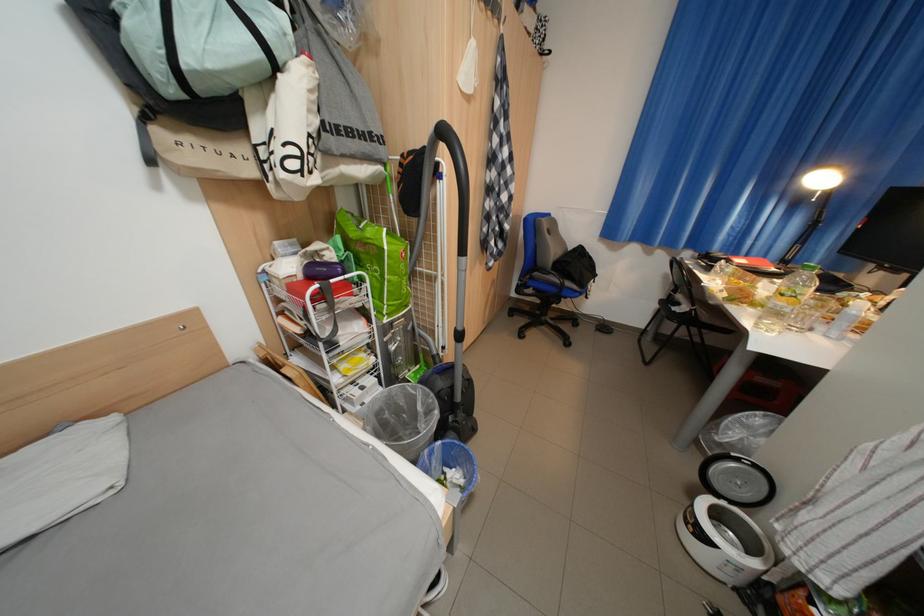
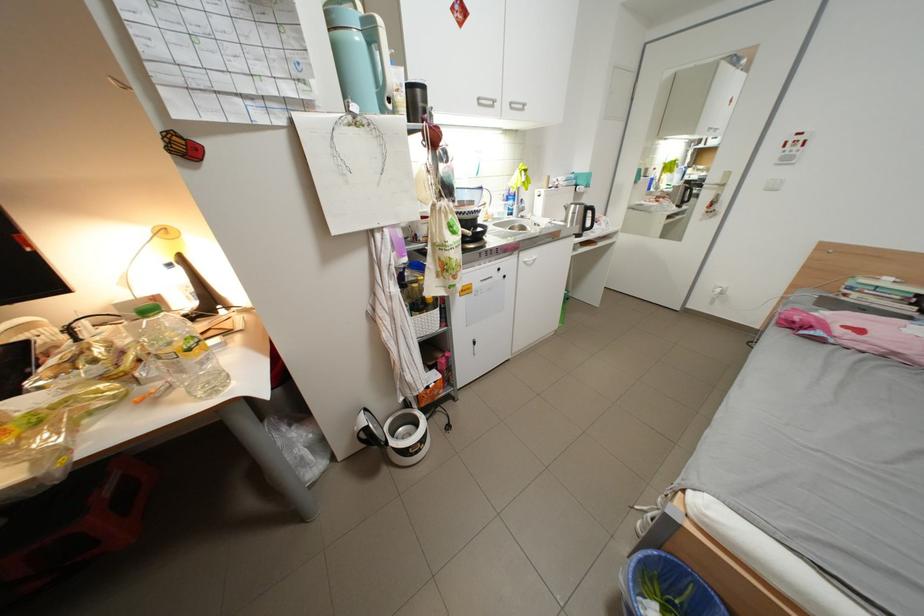
In the second image, find the point that corresponds to the point at 723,501 in the first image.

(404, 444)